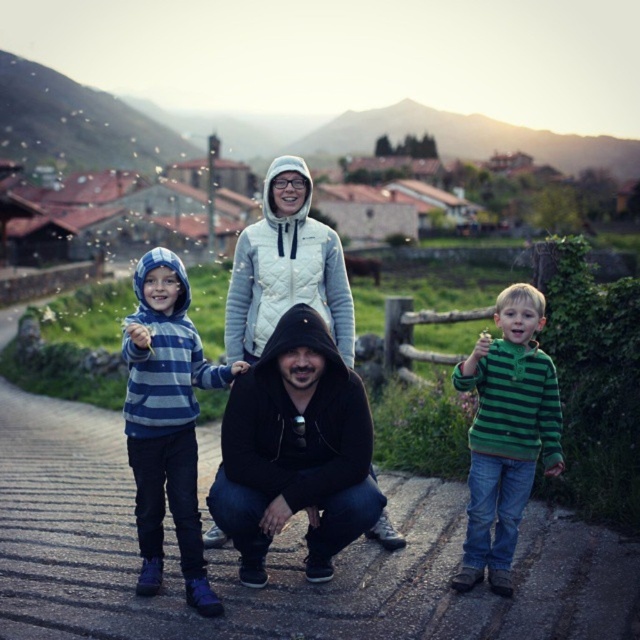
You are standing on the paved path where the family is gathered. You want to walk to the point marked by the coordinates point (273, 557). Which direction should you walk to reach that point?

The point (273, 557) is on the dark asphalt road at center, so you should walk towards the center of the dark asphalt road to reach it.

You are standing on the dark asphalt road at center and want to give the striped hoodie at center a gift. In which direction should you move to reach them?

The striped hoodie at center is to the left of the dark asphalt road at center, so you should move to your left to reach them.

Based on the coordinates provided, where is the striped hoodie at center located in the image?

The striped hoodie at center is located at coordinates point [285,264].